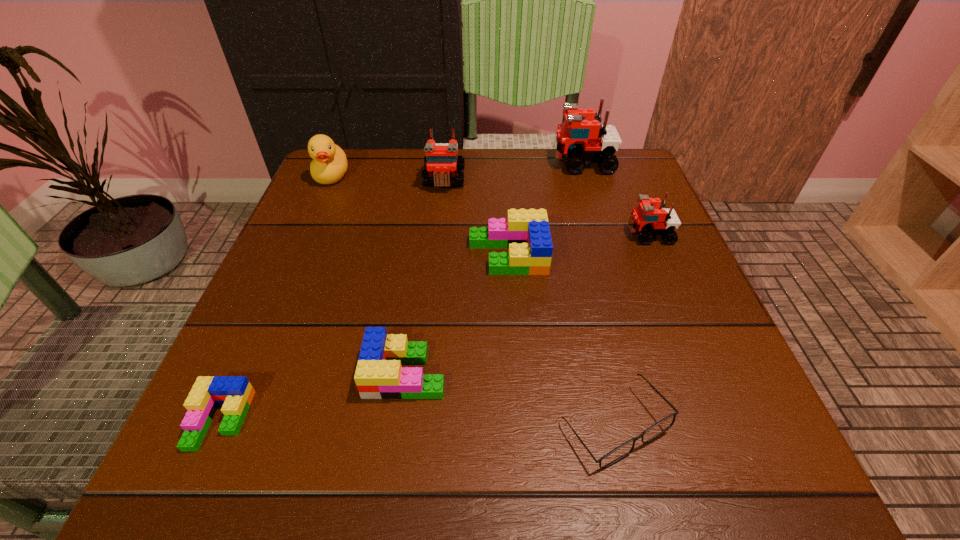
Identify which Lego is the second closest to the leftmost red Lego. Please provide its 2D coordinates. Your answer should be formatted as a tuple, i.e. [(x, y)], where the tuple contains the x and y coordinates of a point satisfying the conditions above.

[(582, 138)]

This screenshot has width=960, height=540. In order to click on the third closest red Lego to the second biggest green Lego in this screenshot , I will do `click(582, 138)`.

Locate which red Lego is the third closest to the second green Lego from right to left. Please provide its 2D coordinates. Your answer should be formatted as a tuple, i.e. [(x, y)], where the tuple contains the x and y coordinates of a point satisfying the conditions above.

[(582, 138)]

Identify the location of green Lego that can be found as the second closest to the leftmost Lego. (526, 233).

The image size is (960, 540). Find the location of `green Lego that is the closest to the biggest red Lego`. green Lego that is the closest to the biggest red Lego is located at coordinates (526, 233).

Identify the location of blank space that satisfies the following two spatial constraints: 1. on the front-facing side of the tallest Lego; 2. with the lenses facing outward on the spectacles. The image size is (960, 540). (664, 425).

Locate an element on the screen. free space that satisfies the following two spatial constraints: 1. on the front-facing side of the smallest red Lego; 2. on the front side of the smallest green Lego is located at coordinates (728, 420).

Find the location of a particular element. Image resolution: width=960 pixels, height=540 pixels. vacant region that satisfies the following two spatial constraints: 1. on the front-facing side of the fourth tallest object; 2. on the front side of the third shortest Lego is located at coordinates (658, 255).

In order to click on vacant region that satisfies the following two spatial constraints: 1. at the beak of the fifth tallest Lego; 2. on the right side of the yellow duck in this screenshot , I will do `click(246, 373)`.